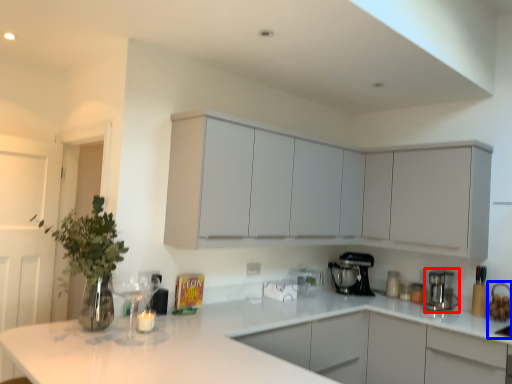
Question: Which object appears farthest to the camera in this image, kitchen appliance (highlighted by a red box) or sink (highlighted by a blue box)?

Choices:
 (A) kitchen appliance
 (B) sink

Answer: (A)